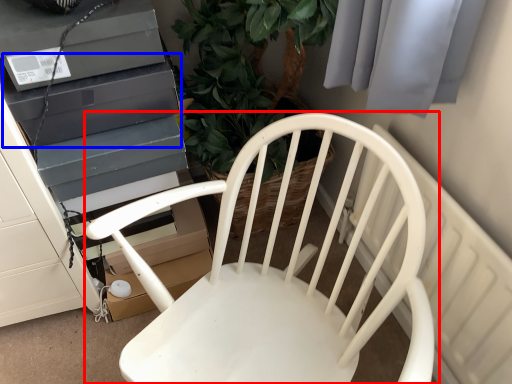
Question: Which of the following is the farthest to the observer, chair (highlighted by a red box) or appliance (highlighted by a blue box)?

Choices:
 (A) chair
 (B) appliance

Answer: (B)